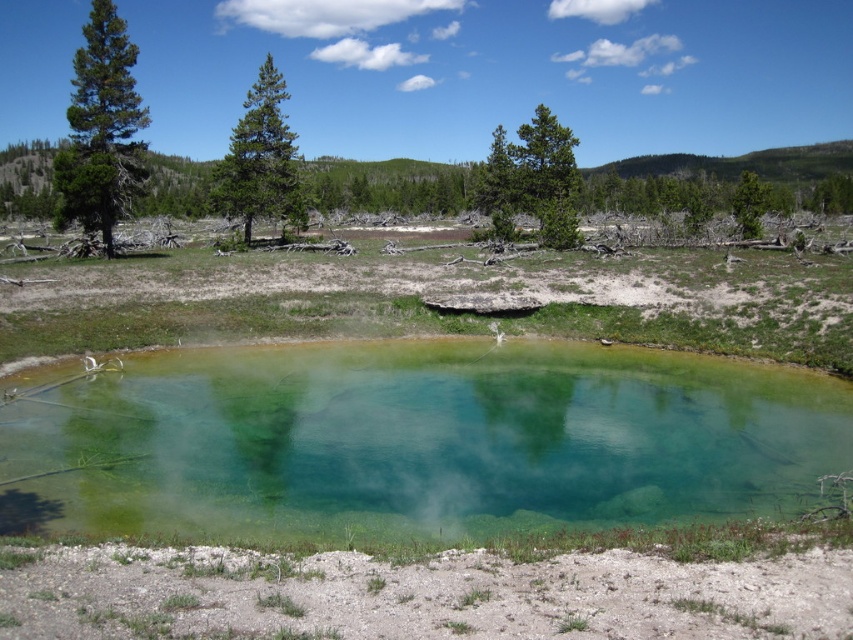
In the scene shown: You are standing at the edge of the hot spring and want to walk towards the green pine tree at left and the green matte tree at upper right. Which tree will you reach first?

You will reach the green pine tree at left first because it is closer to you than the green matte tree at upper right.

You are planning to build a small wooden platform for resting near the hot spring. You want to ensure that the platform won not block the view of the green pine tree at center from the green rough bark tree at upper center. Which tree is closer to the hot spring, and therefore more likely to have its view obstructed if the platform is built near the water?

The green pine tree at center is closer to the hot spring than the green rough bark tree at upper center. Therefore, building the platform near the hot spring would more likely block the view of the green pine tree at center from the green rough bark tree at upper center.

You are standing at the edge of the hot spring and want to determine which tree is taller between the green rough bark tree at upper center and the green pine tree at center. Based on the scene, which one is taller?

The green pine tree at center is taller than the green rough bark tree at upper center.